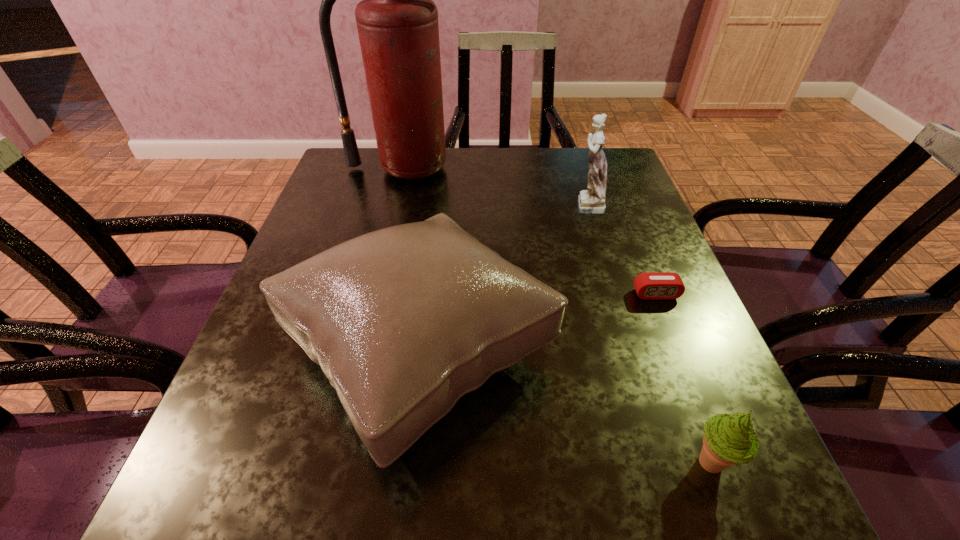
The image size is (960, 540). Find the location of `the farthest object`. the farthest object is located at coordinates (397, 21).

Where is `the tallest object`? The height and width of the screenshot is (540, 960). the tallest object is located at coordinates (397, 21).

I want to click on figurine, so click(x=591, y=201).

This screenshot has width=960, height=540. Identify the location of cushion. (403, 321).

Locate an element on the screen. icecream is located at coordinates (728, 439).

Where is `alarm clock`? alarm clock is located at coordinates (651, 285).

Find the location of a particular element. This screenshot has height=540, width=960. vacant region located at the front of the fire extinguisher where the nozzle is aimed is located at coordinates (377, 275).

Image resolution: width=960 pixels, height=540 pixels. I want to click on vacant space located 0.120m on the front-facing side of the figurine, so click(x=518, y=205).

Image resolution: width=960 pixels, height=540 pixels. Identify the location of vacant point located on the front-facing side of the figurine. (539, 205).

Where is `vacant area situated 0.360m on the front-facing side of the figurine`? The image size is (960, 540). vacant area situated 0.360m on the front-facing side of the figurine is located at coordinates (422, 205).